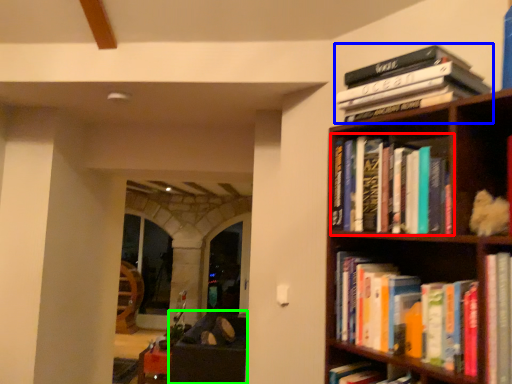
Question: Based on their relative distances, which object is nearer to book (highlighted by a red box)? Choose from book (highlighted by a blue box) and furniture (highlighted by a green box).

Choices:
 (A) book
 (B) furniture

Answer: (A)